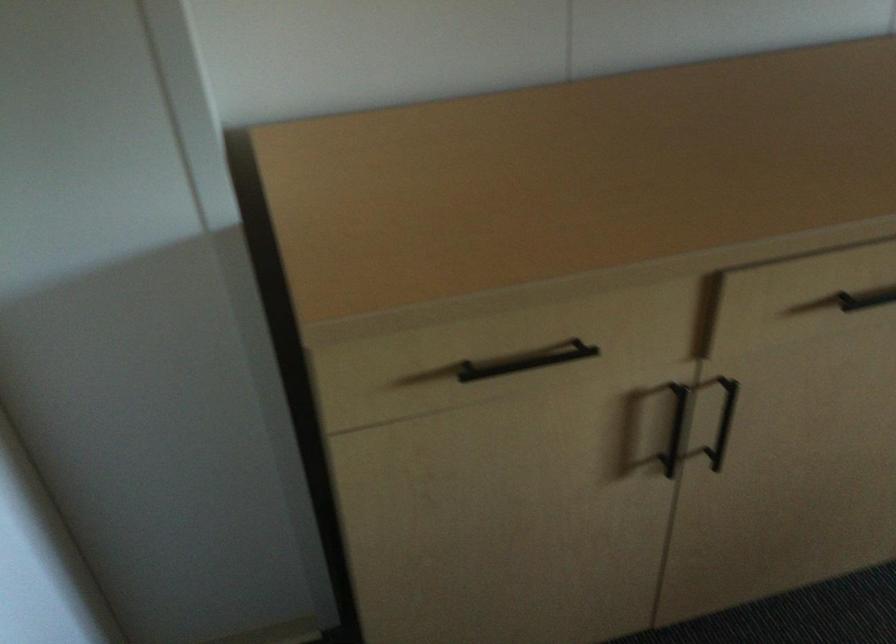
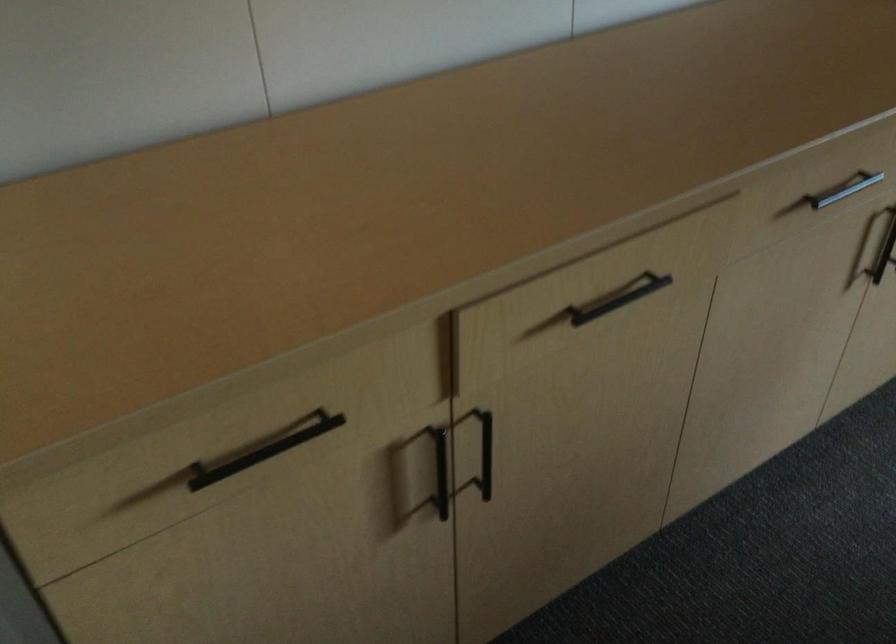
The images are taken continuously from a first-person perspective. In which direction are you moving?

The cameraman moved toward right, forward.